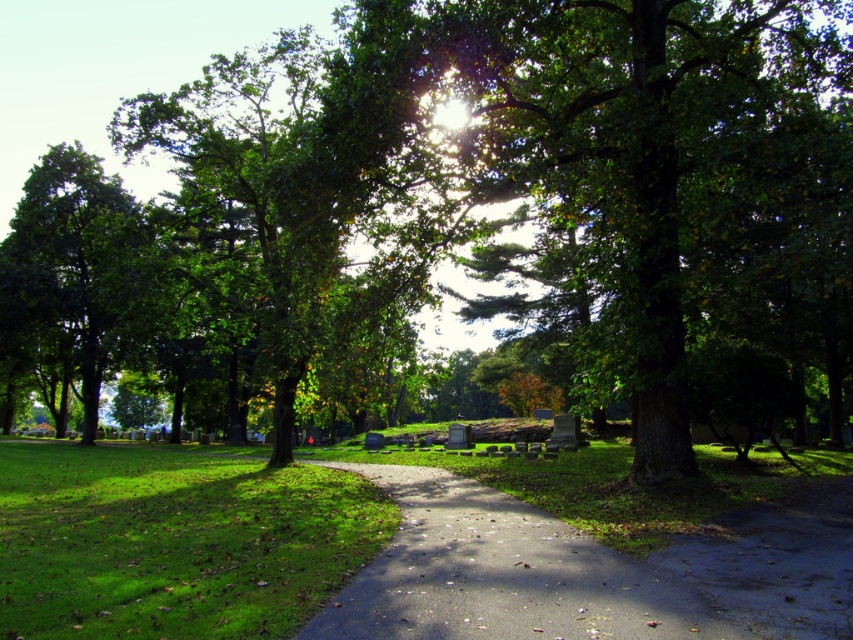
You are a gardener who needs to mow the lawn. You see the green grassy at center and the green leafy tree at left. Which area requires more attention to mow?

The green grassy at center requires more attention because its width is narrower than the green leafy tree at left, so it might need closer trimming or adjustment to match the desired landscape balance.

You are a hiker walking along the asphalt path at center and notice a green leafy tree at left. Which direction should you walk to get closer to the tree?

To get closer to the green leafy tree at left, you should walk towards the left side of the asphalt path at center since the tree is positioned to the left of the path.

You are standing at the point closer to the camera in the park scene. Which point are you at, point (439,600) or point (65,152)?

You are at point (439,600) because it is closer to the camera than point (65,152).